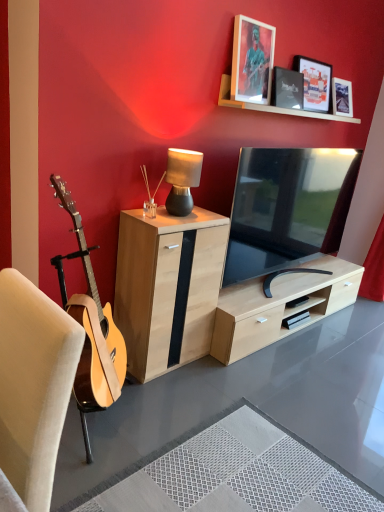
You are a GUI agent. You are given a task and a screenshot of the screen. Output one action in this format:
    pyautogui.click(x=<x>, y=<y>)
    Task: Click on the vacant space behind white textured rug at lower center
    The height and width of the screenshot is (512, 384).
    Given the screenshot: What is the action you would take?
    pyautogui.click(x=233, y=386)